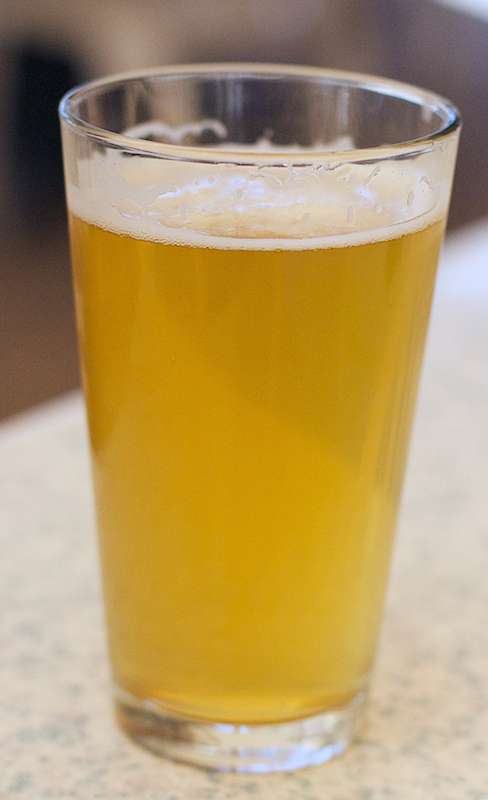
Identify the location of beer in glass. (233, 406), (224, 621), (323, 518), (161, 538).